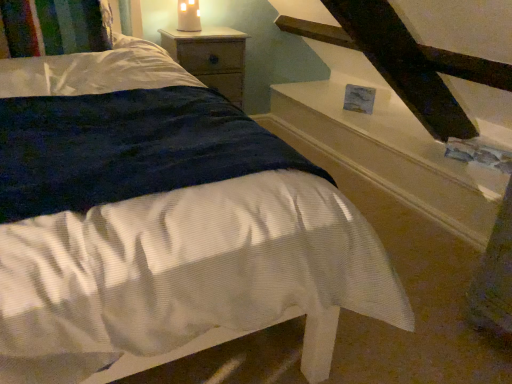
Question: Could you tell me if multicolored knitted pillow at upper left is facing wooden nightstand at upper center?

Choices:
 (A) yes
 (B) no

Answer: (B)

Question: Would you consider multicolored knitted pillow at upper left to be distant from wooden nightstand at upper center?

Choices:
 (A) no
 (B) yes

Answer: (A)

Question: Can you confirm if multicolored knitted pillow at upper left is positioned to the right of wooden nightstand at upper center?

Choices:
 (A) no
 (B) yes

Answer: (A)

Question: From the image's perspective, is multicolored knitted pillow at upper left located beneath wooden nightstand at upper center?

Choices:
 (A) yes
 (B) no

Answer: (A)

Question: Can you confirm if multicolored knitted pillow at upper left is wider than wooden nightstand at upper center?

Choices:
 (A) yes
 (B) no

Answer: (A)

Question: Considering the positions of matte white candle at upper center and wooden nightstand at upper center in the image, is matte white candle at upper center wider or thinner than wooden nightstand at upper center?

Choices:
 (A) thin
 (B) wide

Answer: (A)

Question: From a real-world perspective, is matte white candle at upper center physically located above or below wooden nightstand at upper center?

Choices:
 (A) above
 (B) below

Answer: (A)

Question: From the image's perspective, is matte white candle at upper center located above or below wooden nightstand at upper center?

Choices:
 (A) above
 (B) below

Answer: (A)

Question: In terms of size, does matte white candle at upper center appear bigger or smaller than wooden nightstand at upper center?

Choices:
 (A) small
 (B) big

Answer: (A)

Question: From a real-world perspective, relative to multicolored knitted pillow at upper left, is white glossy stairwell at upper right vertically above or below?

Choices:
 (A) below
 (B) above

Answer: (A)

Question: Is white glossy stairwell at upper right spatially inside multicolored knitted pillow at upper left, or outside of it?

Choices:
 (A) outside
 (B) inside

Answer: (A)

Question: Considering the positions of white glossy stairwell at upper right and multicolored knitted pillow at upper left in the image, is white glossy stairwell at upper right taller or shorter than multicolored knitted pillow at upper left?

Choices:
 (A) short
 (B) tall

Answer: (B)

Question: In the image, is white glossy stairwell at upper right positioned in front of or behind multicolored knitted pillow at upper left?

Choices:
 (A) behind
 (B) front

Answer: (A)

Question: Would you say wooden nightstand at upper center is to the left or to the right of matte white candle at upper center in the picture?

Choices:
 (A) left
 (B) right

Answer: (B)

Question: In the image, is wooden nightstand at upper center positioned in front of or behind matte white candle at upper center?

Choices:
 (A) front
 (B) behind

Answer: (A)